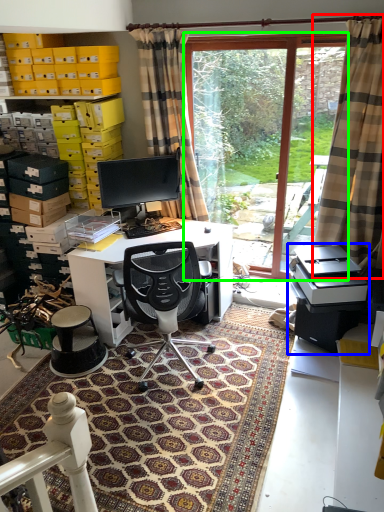
Question: Which is nearer to the curtain (highlighted by a red box)? printer (highlighted by a blue box) or glass door (highlighted by a green box).

Choices:
 (A) printer
 (B) glass door

Answer: (A)